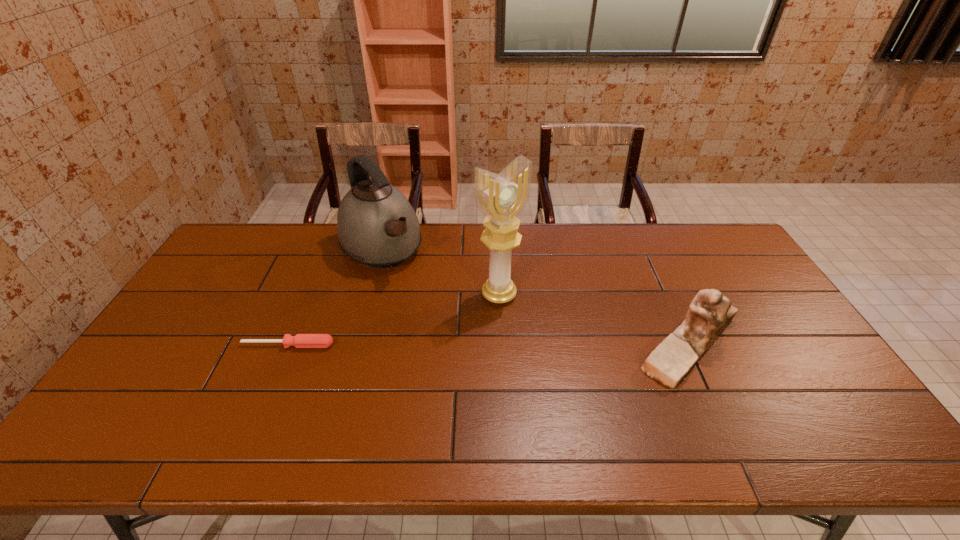
Locate an element on the screen. The image size is (960, 540). the shortest object is located at coordinates (300, 340).

At what (x,y) coordinates should I click in order to perform the action: click on figurine. Please return your answer as a coordinate pair (x, y). Looking at the image, I should click on (710, 312).

What are the coordinates of `the third tallest object` in the screenshot? It's located at (710, 312).

Locate an element on the screen. The width and height of the screenshot is (960, 540). kettle is located at coordinates (376, 225).

What are the coordinates of `the farthest object` in the screenshot? It's located at (376, 225).

In order to click on award in this screenshot , I will do `click(501, 198)`.

Image resolution: width=960 pixels, height=540 pixels. Find the location of `the tallest object`. the tallest object is located at coordinates 501,198.

At what (x,y) coordinates should I click in order to perform the action: click on vacant area situated 0.200m at the tip of the screwdriver. Please return your answer as a coordinate pair (x, y). The height and width of the screenshot is (540, 960). Looking at the image, I should click on (259, 415).

You are a GUI agent. You are given a task and a screenshot of the screen. Output one action in this format:
    pyautogui.click(x=<x>, y=<y>)
    Task: Click on the vacant region located on the front-facing side of the figurine
    
    Given the screenshot: What is the action you would take?
    pyautogui.click(x=582, y=345)

The width and height of the screenshot is (960, 540). What are the coordinates of `free space located 0.070m on the front-facing side of the figurine` in the screenshot? It's located at (607, 345).